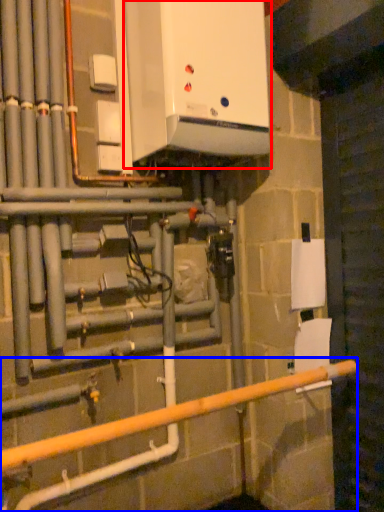
Question: Which of the following is the closest to the observer, home appliance (highlighted by a red box) or rail (highlighted by a blue box)?

Choices:
 (A) home appliance
 (B) rail

Answer: (B)